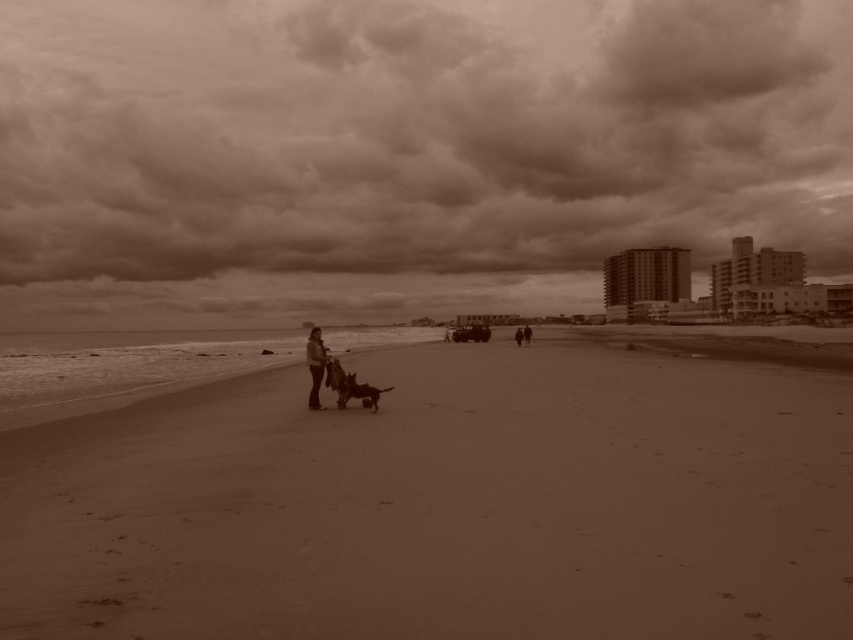
Question: Which of the following is the closest to the observer?

Choices:
 (A) (520, 333)
 (B) (323, 356)
 (C) (573, 42)

Answer: (B)

Question: Does sepia textured clouds at upper center appear under dark brown leather jacket at center?

Choices:
 (A) no
 (B) yes

Answer: (A)

Question: Which point is closer to the camera?

Choices:
 (A) dark brown leather jacket at center
 (B) smooth sand at center
 (C) matte black jacket at center

Answer: (B)

Question: Based on their relative distances, which object is farther from the smooth sand at center?

Choices:
 (A) matte black jacket at center
 (B) sepia textured clouds at upper center
 (C) dark brown leather jacket at center

Answer: (B)

Question: Is sepia textured clouds at upper center thinner than smooth sand at center?

Choices:
 (A) no
 (B) yes

Answer: (A)

Question: Is smooth sand at center thinner than dark brown leather jacket at center?

Choices:
 (A) yes
 (B) no

Answer: (B)